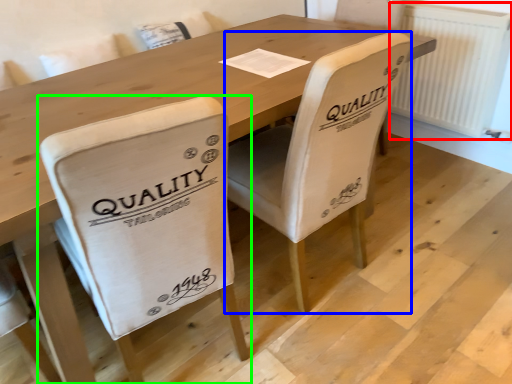
Question: Which object is the closest to the radiator (highlighted by a red box)? Choose among these: chair (highlighted by a blue box) or chair (highlighted by a green box).

Choices:
 (A) chair
 (B) chair

Answer: (A)